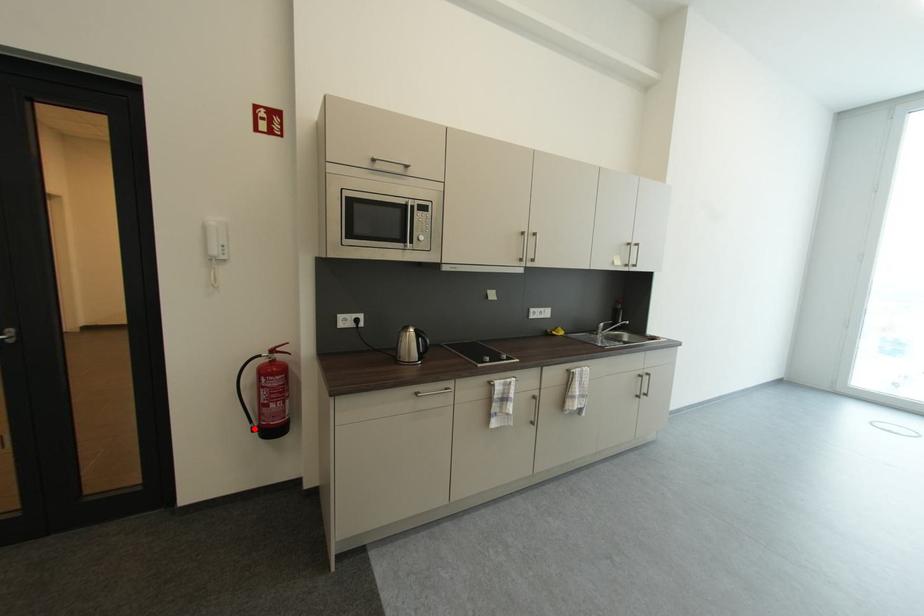
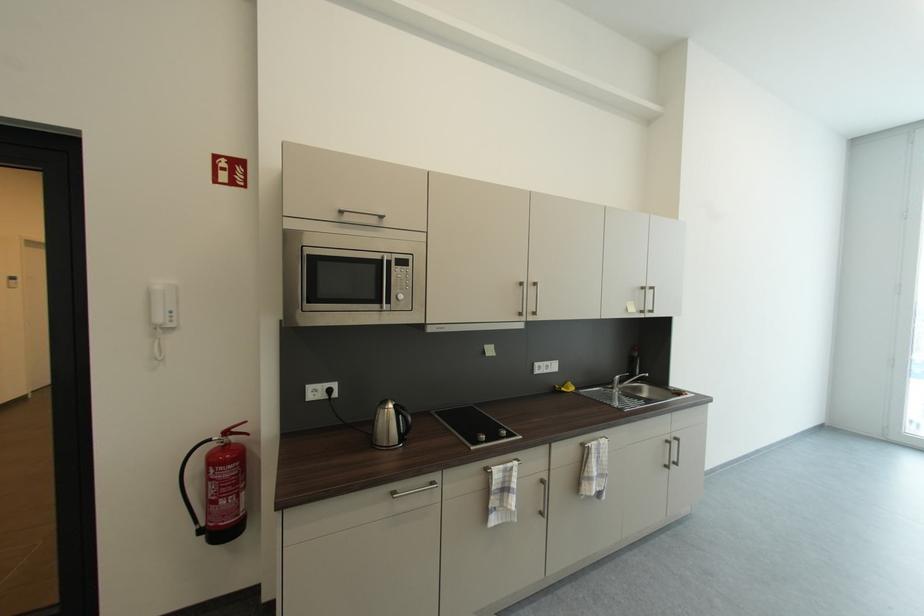
Question: I am providing you with two images of the same scene from different viewpoints. Given a red point in image1, look at the same physical point in image2. Is it:

Choices:
 (A) Closer to the viewpoint
 (B) Farther from the viewpoint

Answer: (A)